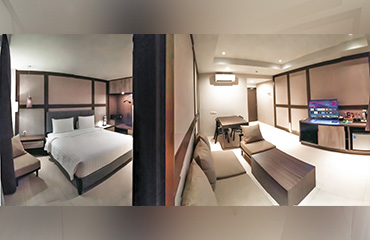
Where is `storage`? This screenshot has height=240, width=370. storage is located at coordinates (328, 134), (361, 138).